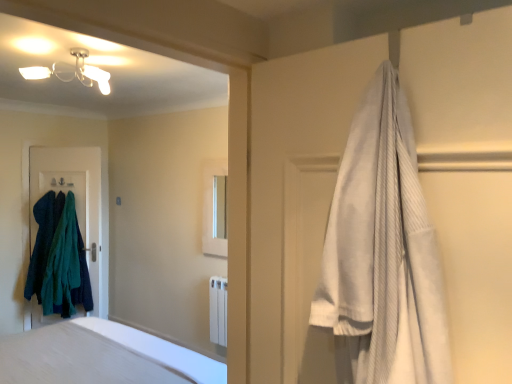
This screenshot has height=384, width=512. What do you see at coordinates (214, 208) in the screenshot?
I see `white glossy medicine cabinet at center` at bounding box center [214, 208].

What are the coordinates of `white soft bed at center` in the screenshot? It's located at (102, 263).

Looking at this image, in order to face teal fuzzy sweater at left, arranged as the first clothing when viewed from the right, should I rotate leftwards or rightwards?

To align with it, rotate left about 24.136°.

I want to click on white glossy medicine cabinet at center, so click(214, 208).

Considering the positions of objects white soft bed at center and white cotton robe at upper right in the image provided, who is more to the left, white soft bed at center or white cotton robe at upper right?

white soft bed at center is more to the left.

From a real-world perspective, who is located lower, white soft bed at center or white cotton robe at upper right?

white soft bed at center.

From the image's perspective, between white soft bed at center and white cotton robe at upper right, which one is located above?

white cotton robe at upper right is shown above in the image.

From a real-world perspective, is dark green fuzzy sweater at left, arranged as the second clothing when viewed from the right, above or below dark blue fabric at left?

In terms of real-world spatial position, dark green fuzzy sweater at left, arranged as the second clothing when viewed from the right, is below dark blue fabric at left.

Who is bigger, dark green fuzzy sweater at left, which is counted as the first clothing, starting from the left, or dark blue fabric at left?

Bigger between the two is dark green fuzzy sweater at left, which is counted as the first clothing, starting from the left.

Is dark green fuzzy sweater at left, which is counted as the first clothing, starting from the left, spatially inside dark blue fabric at left, or outside of it?

dark green fuzzy sweater at left, which is counted as the first clothing, starting from the left, lies outside dark blue fabric at left.

Looking at this image, from the image's perspective, is dark green fuzzy sweater at left, which is counted as the first clothing, starting from the left, located beneath dark blue fabric at left?

Yes.

Looking at this image, does white cotton robe at upper right have a larger size compared to dark blue fabric at left?

No, white cotton robe at upper right is not bigger than dark blue fabric at left.

Which is correct: white cotton robe at upper right is inside dark blue fabric at left, or outside of it?

white cotton robe at upper right is not inside dark blue fabric at left, it's outside.

Are white cotton robe at upper right and dark blue fabric at left beside each other?

white cotton robe at upper right is not next to dark blue fabric at left, and they're not touching.

Is point (311, 368) positioned after point (35, 312)?

No, it is in front of (35, 312).

From the image's perspective, is white cotton robe at upper right located above or below white smooth bathtub at lower left?

Based on their image positions, white cotton robe at upper right is located above white smooth bathtub at lower left.

Considering the points (459, 213) and (96, 336), which point is behind, point (459, 213) or point (96, 336)?

The point (96, 336) is farther from the camera.

From a real-world perspective, is white cotton robe at upper right above or below white smooth bathtub at lower left?

white cotton robe at upper right is situated higher than white smooth bathtub at lower left in the real world.

Can you confirm if white cotton robe at upper right is shorter than white smooth bathtub at lower left?

Incorrect, the height of white cotton robe at upper right does not fall short of that of white smooth bathtub at lower left.

There is a dark blue fabric at left. Where is `the 2nd clothing below it (from a real-world perspective)`? The width and height of the screenshot is (512, 384). the 2nd clothing below it (from a real-world perspective) is located at coordinates (66, 265).

Which is in front, point (83, 190) or point (54, 235)?

Positioned in front is point (54, 235).

From the picture: From a real-world perspective, between dark blue fabric at left and teal fuzzy sweater at left, the second clothing from the left, who is vertically higher?

In real-world perspective, dark blue fabric at left is above.

Considering the relative sizes of dark blue fabric at left and teal fuzzy sweater at left, arranged as the first clothing when viewed from the right, in the image provided, is dark blue fabric at left taller than teal fuzzy sweater at left, arranged as the first clothing when viewed from the right,?

Yes, dark blue fabric at left is taller than teal fuzzy sweater at left, arranged as the first clothing when viewed from the right.

Considering the sizes of objects white glossy medicine cabinet at center and teal fuzzy sweater at left, arranged as the first clothing when viewed from the right, in the image provided, who is shorter, white glossy medicine cabinet at center or teal fuzzy sweater at left, arranged as the first clothing when viewed from the right,?

white glossy medicine cabinet at center.

Is teal fuzzy sweater at left, arranged as the first clothing when viewed from the right, at the back of white glossy medicine cabinet at center?

white glossy medicine cabinet at center is not turned away from teal fuzzy sweater at left, arranged as the first clothing when viewed from the right.

Who is smaller, white glossy medicine cabinet at center or teal fuzzy sweater at left, arranged as the first clothing when viewed from the right?

white glossy medicine cabinet at center.

In the scene shown: Between dark blue fabric at left and white glossy medicine cabinet at center, which one has larger size?

With larger size is dark blue fabric at left.

Considering the relative sizes of dark blue fabric at left and white glossy medicine cabinet at center in the image provided, is dark blue fabric at left taller than white glossy medicine cabinet at center?

Indeed, dark blue fabric at left has a greater height compared to white glossy medicine cabinet at center.

Between point (30, 163) and point (206, 190), which one is positioned behind?

Point (30, 163)

Where is `door that appears below the white glossy medicine cabinet at center (from the image's perspective)`? The height and width of the screenshot is (384, 512). door that appears below the white glossy medicine cabinet at center (from the image's perspective) is located at coordinates (75, 198).

The height and width of the screenshot is (384, 512). I want to click on closet above the white soft bed at center (from a real-world perspective), so click(x=468, y=176).

Find the location of a particular element. clothing that is the 1st one when counting downward from the dark blue fabric at left (from the image's perspective) is located at coordinates (41, 244).

From the picture: Which object lies nearer to the anchor point dark green fuzzy sweater at left, arranged as the second clothing when viewed from the right, teal fuzzy sweater at left, the second clothing from the left, or white soft bed at center?

Among the two, teal fuzzy sweater at left, the second clothing from the left, is located nearer to dark green fuzzy sweater at left, arranged as the second clothing when viewed from the right.

Based on their spatial positions, is white smooth bathtub at lower left or white soft bed at center closer to dark blue fabric at left?

white soft bed at center lies closer to dark blue fabric at left than the other object.

Estimate the real-world distances between objects in this image. Which object is further from white smooth bathtub at lower left, white cotton robe at upper right or dark blue fabric at left?

dark blue fabric at left is further to white smooth bathtub at lower left.

Which object lies nearer to the anchor point teal fuzzy sweater at left, the second clothing from the left, white glossy medicine cabinet at center or dark blue fabric at left?

Based on the image, dark blue fabric at left appears to be nearer to teal fuzzy sweater at left, the second clothing from the left.

Looking at the image, which one is located further to dark green fuzzy sweater at left, which is counted as the first clothing, starting from the left, white glossy medicine cabinet at center or teal fuzzy sweater at left, arranged as the first clothing when viewed from the right?

white glossy medicine cabinet at center lies further to dark green fuzzy sweater at left, which is counted as the first clothing, starting from the left, than the other object.

When comparing their distances from dark green fuzzy sweater at left, which is counted as the first clothing, starting from the left, does white soft bed at center or teal fuzzy sweater at left, arranged as the first clothing when viewed from the right, seem closer?

teal fuzzy sweater at left, arranged as the first clothing when viewed from the right, lies closer to dark green fuzzy sweater at left, which is counted as the first clothing, starting from the left, than the other object.

From the image, which object appears to be farther from white glossy medicine cabinet at center, dark green fuzzy sweater at left, which is counted as the first clothing, starting from the left, or dark blue fabric at left?

dark green fuzzy sweater at left, which is counted as the first clothing, starting from the left, lies further to white glossy medicine cabinet at center than the other object.

When comparing their distances from white soft bed at center, does dark green fuzzy sweater at left, arranged as the second clothing when viewed from the right, or white glossy medicine cabinet at center seem further?

white glossy medicine cabinet at center is further to white soft bed at center.

What are the coordinates of `bed between white cotton robe at upper right and dark green fuzzy sweater at left, which is counted as the first clothing, starting from the left, in the front-back direction` in the screenshot? It's located at (102, 263).

Image resolution: width=512 pixels, height=384 pixels. What are the coordinates of `clothing located between white soft bed at center and dark green fuzzy sweater at left, arranged as the second clothing when viewed from the right, in the depth direction` in the screenshot? It's located at (66, 265).

Find the location of a particular element. The image size is (512, 384). bed positioned between white cotton robe at upper right and white glossy medicine cabinet at center from near to far is located at coordinates (102, 263).

Identify the location of bathtub between white soft bed at center and dark blue fabric at left in the front-back direction. This screenshot has width=512, height=384. (101, 356).